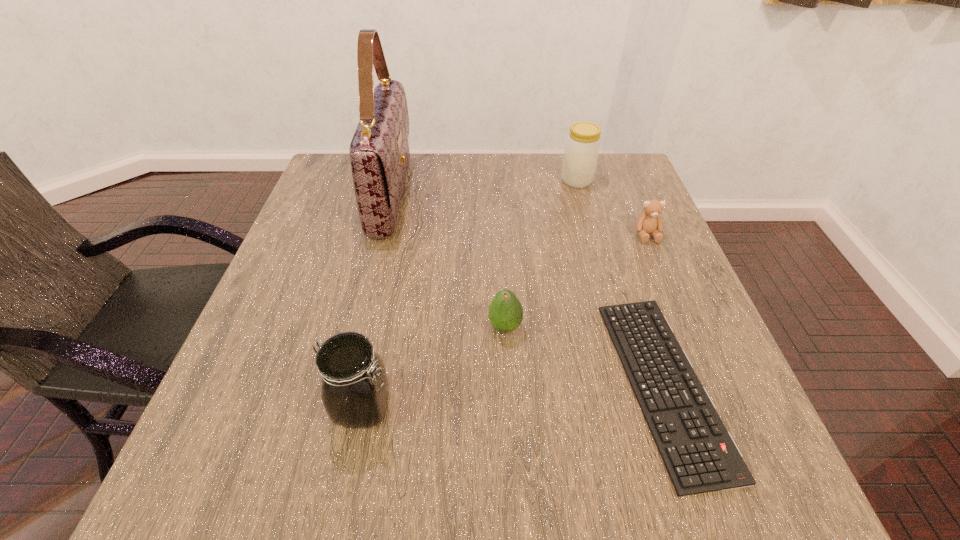
You are a GUI agent. You are given a task and a screenshot of the screen. Output one action in this format:
    pyautogui.click(x=<x>, y=<y>)
    Task: Click on the free space between the third object from left to right and the teddy bear
    
    Given the screenshot: What is the action you would take?
    pyautogui.click(x=576, y=281)

Where is `vacant area that lies between the farther jar and the avocado`? The height and width of the screenshot is (540, 960). vacant area that lies between the farther jar and the avocado is located at coordinates (540, 254).

The height and width of the screenshot is (540, 960). Find the location of `empty space that is in between the avocado and the computer keyboard`. empty space that is in between the avocado and the computer keyboard is located at coordinates (585, 355).

At what (x,y) coordinates should I click in order to perform the action: click on blank region between the avocado and the teddy bear. Please return your answer as a coordinate pair (x, y). Looking at the image, I should click on (576, 281).

Locate an element on the screen. vacant point located between the right jar and the shortest object is located at coordinates (620, 282).

Locate an element on the screen. This screenshot has height=540, width=960. unoccupied area between the third object from left to right and the tallest object is located at coordinates (448, 261).

At what (x,y) coordinates should I click in order to perform the action: click on free area in between the farther jar and the computer keyboard. Please return your answer as a coordinate pair (x, y). Looking at the image, I should click on (620, 282).

In order to click on the second closest object to the shortest object in this screenshot , I will do `click(649, 222)`.

Image resolution: width=960 pixels, height=540 pixels. What are the coordinates of `object that is the second closest one to the nearer jar` in the screenshot? It's located at (700, 455).

You are a GUI agent. You are given a task and a screenshot of the screen. Output one action in this format:
    pyautogui.click(x=<x>, y=<y>)
    Task: Click on the vacant region that satisfies the following two spatial constraints: 1. on the face of the teddy bear; 2. on the lid of the left jar
    Image resolution: width=960 pixels, height=540 pixels.
    Given the screenshot: What is the action you would take?
    pyautogui.click(x=719, y=407)